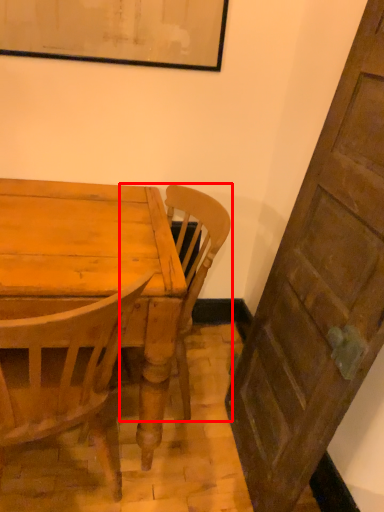
Question: From the image, what is the correct spatial relationship of chair (annotated by the red box) in relation to table top?

Choices:
 (A) right
 (B) left

Answer: (A)